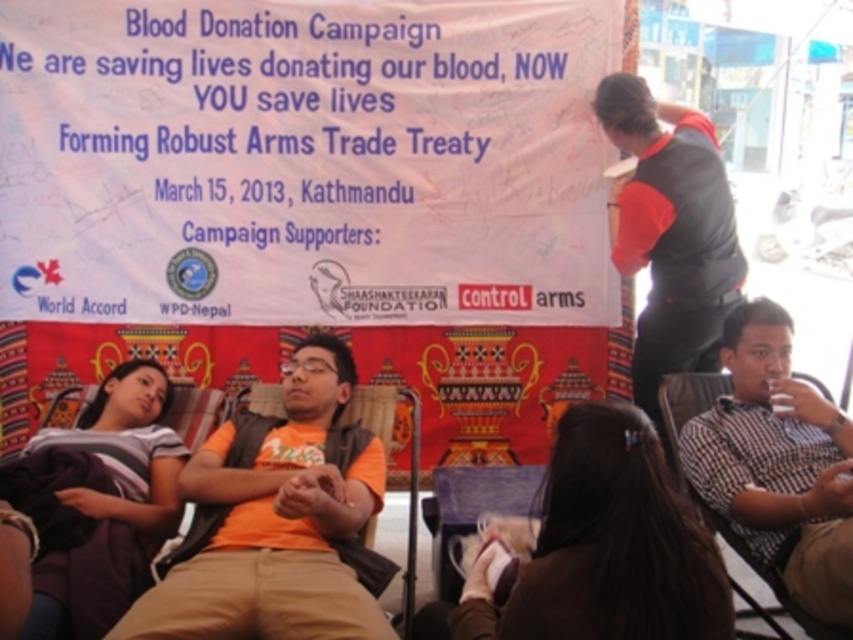
Does brown hair at center have a greater height compared to gray cotton shirt at lower left?

In fact, brown hair at center may be shorter than gray cotton shirt at lower left.

Does brown hair at center have a lesser width compared to gray cotton shirt at lower left?

No.

Does point (596, 605) come farther from viewer compared to point (80, 449)?

That is False.

This screenshot has height=640, width=853. I want to click on brown hair at center, so click(x=604, y=545).

Who is positioned more to the left, orange fabric shirt at center or red-orange sleeve at upper right?

orange fabric shirt at center is more to the left.

Which of these two, orange fabric shirt at center or red-orange sleeve at upper right, stands taller?

red-orange sleeve at upper right is taller.

Find the location of a particular element. This screenshot has width=853, height=640. orange fabric shirt at center is located at coordinates (276, 524).

Is point (844, 595) more distant than point (131, 465)?

No, (844, 595) is in front of (131, 465).

Between point (740, 344) and point (165, 401), which one is positioned in front?

Point (740, 344)

The height and width of the screenshot is (640, 853). What are the coordinates of `checkered fabric shirt at right` in the screenshot? It's located at point(776,464).